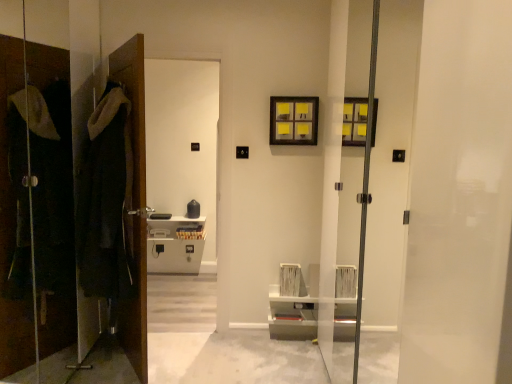
Find the location of a particular element. matte black coat at left is located at coordinates (68, 211).

Locate an element on the screen. The width and height of the screenshot is (512, 384). matte black coat at left is located at coordinates (68, 211).

Between matte black coat at left and brown wooden door at left, which one appears on the right side from the viewer's perspective?

brown wooden door at left is more to the right.

Is matte black coat at left behind brown wooden door at left?

No.

Between matte black coat at left and brown wooden door at left, which one has larger size?

Bigger between the two is matte black coat at left.

Are matte black coat at left and brown wooden door at left beside each other?

matte black coat at left and brown wooden door at left are not in contact.

The width and height of the screenshot is (512, 384). I want to click on door lying below the dark woolen robe at left (from the image's perspective), so click(134, 202).

Is the depth of brown wooden door at left less than that of dark woolen robe at left?

No, brown wooden door at left is further to the viewer.

How many degrees apart are the facing directions of brown wooden door at left and dark woolen robe at left?

The facing directions of brown wooden door at left and dark woolen robe at left are 94.1 degrees apart.

Between brown wooden door at left and dark woolen robe at left, which one appears on the right side from the viewer's perspective?

Positioned to the right is brown wooden door at left.

Considering the sizes of brown wooden door at left and wooden picture frame at upper center in the image, is brown wooden door at left wider or thinner than wooden picture frame at upper center?

Clearly, brown wooden door at left has less width compared to wooden picture frame at upper center.

From a real-world perspective, which object rests below the other?

In real-world perspective, brown wooden door at left is lower.

Is brown wooden door at left in contact with wooden picture frame at upper center?

brown wooden door at left and wooden picture frame at upper center are clearly separated.

This screenshot has width=512, height=384. In order to click on picture frame behind the brown wooden door at left in this screenshot , I will do `click(293, 120)`.

From the image's perspective, is brown wooden door at left on matte black coat at left?

No, from the image's perspective, brown wooden door at left is not over matte black coat at left.

Is brown wooden door at left positioned far away from matte black coat at left?

No, brown wooden door at left is not far away from matte black coat at left.

Based on the photo, which is behind, brown wooden door at left or matte black coat at left?

brown wooden door at left is behind.

From a real-world perspective, who is located higher, brown wooden door at left or matte black coat at left?

In real-world perspective, matte black coat at left is above.

The width and height of the screenshot is (512, 384). In order to click on closet that appears on the left of dark woolen robe at left in this screenshot , I will do `click(68, 211)`.

Can you tell me how much matte black coat at left and dark woolen robe at left differ in facing direction?

They differ by 64.1 degrees in their facing directions.

Is matte black coat at left taller than dark woolen robe at left?

Correct, matte black coat at left is much taller as dark woolen robe at left.

From the picture: Is matte black coat at left positioned far away from dark woolen robe at left?

matte black coat at left is actually quite close to dark woolen robe at left.

Is dark woolen robe at left located outside matte black coat at left?

That's correct, dark woolen robe at left is outside of matte black coat at left.

Is there a large distance between dark woolen robe at left and matte black coat at left?

That's not correct — dark woolen robe at left is a little close to matte black coat at left.

In the scene shown: Can you confirm if dark woolen robe at left is thinner than matte black coat at left?

Incorrect, the width of dark woolen robe at left is not less than that of matte black coat at left.

Based on the photo, how different are the orientations of dark woolen robe at left and matte black coat at left in degrees?

The angle between the facing direction of dark woolen robe at left and the facing direction of matte black coat at left is 64.1 degrees.

Are dark woolen robe at left and wooden picture frame at upper center far apart?

Yes.

The image size is (512, 384). Find the location of `picture frame on the right of dark woolen robe at left`. picture frame on the right of dark woolen robe at left is located at coordinates (293, 120).

Is dark woolen robe at left to the left of wooden picture frame at upper center from the viewer's perspective?

Correct, you'll find dark woolen robe at left to the left of wooden picture frame at upper center.

Is dark woolen robe at left in front of wooden picture frame at upper center?

Yes, it is in front of wooden picture frame at upper center.

The height and width of the screenshot is (384, 512). What are the coordinates of `closet that appears above the brown wooden door at left (from a real-world perspective)` in the screenshot? It's located at (68, 211).

Identify the location of door behind the dark woolen robe at left. Image resolution: width=512 pixels, height=384 pixels. (134, 202).

When comparing their distances from matte black coat at left, does brown wooden door at left or dark woolen robe at left seem closer?

dark woolen robe at left lies closer to matte black coat at left than the other object.

Considering their positions, is brown wooden door at left positioned further to matte black coat at left than wooden picture frame at upper center?

wooden picture frame at upper center lies further to matte black coat at left than the other object.

Which object lies nearer to the anchor point matte black coat at left, dark woolen robe at left or wooden picture frame at upper center?

dark woolen robe at left.

Looking at the image, which one is located further to matte black coat at left, wooden picture frame at upper center or dark woolen robe at left?

wooden picture frame at upper center is positioned further to the anchor matte black coat at left.

Estimate the real-world distances between objects in this image. Which object is closer to wooden picture frame at upper center, brown wooden door at left or matte black coat at left?

brown wooden door at left.

When comparing their distances from matte black coat at left, does dark woolen robe at left or brown wooden door at left seem closer?

dark woolen robe at left.

Which object lies nearer to the anchor point dark woolen robe at left, brown wooden door at left or matte black coat at left?

matte black coat at left lies closer to dark woolen robe at left than the other object.

From the image, which object appears to be farther from wooden picture frame at upper center, matte black coat at left or brown wooden door at left?

matte black coat at left.

I want to click on door between matte black coat at left and wooden picture frame at upper center, so (134, 202).

Locate an element on the screen. The image size is (512, 384). door between dark woolen robe at left and wooden picture frame at upper center from left to right is located at coordinates (134, 202).

I want to click on robe positioned between matte black coat at left and brown wooden door at left from near to far, so click(105, 199).

I want to click on robe situated between matte black coat at left and wooden picture frame at upper center from left to right, so click(105, 199).